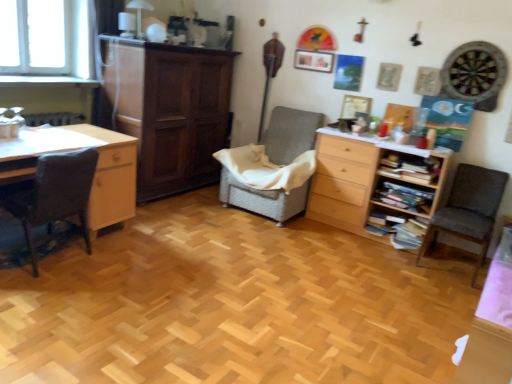
Image resolution: width=512 pixels, height=384 pixels. In order to click on vacant space in between dark gray fabric chair at left, the first chair from the left, and woven fabric chair at center, positioned as the second chair in right-to-left order in this screenshot , I will do `click(182, 230)`.